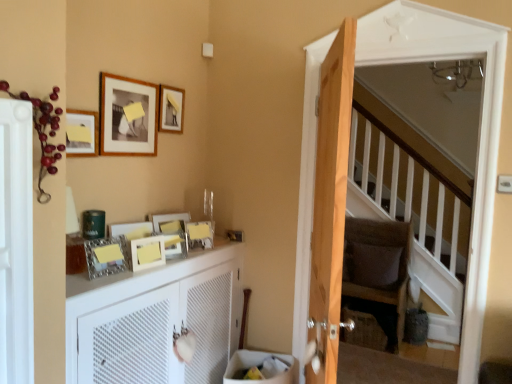
Question: Is matte wooden picture frame at upper left, the second picture frame from the top, wider or thinner than matte wooden picture frame at upper left, which is the third picture frame in top-to-bottom order?

Choices:
 (A) wide
 (B) thin

Answer: (B)

Question: In the image, is matte wooden picture frame at upper left, which appears as the 7th picture frame when ordered from the bottom, positioned in front of or behind matte wooden picture frame at upper left, which is the third picture frame in top-to-bottom order?

Choices:
 (A) front
 (B) behind

Answer: (B)

Question: Which object is the closest to the matte wooden picture frame at upper center, acting as the fifth picture frame starting from the bottom?

Choices:
 (A) matte silver picture frame at center, which ranks as the seventh picture frame in top-to-bottom order
 (B) light brown wooden door at center
 (C) brown fabric pillow at center
 (D) white matte radiator at left, which is the 1th screen door in front-to-back order
 (E) matte wooden picture frame at upper left, which appears as the 7th picture frame when ordered from the bottom

Answer: (A)

Question: Which of these objects is positioned closest to the metallic silver picture frame at upper center, which is the fifth picture frame from top to bottom?

Choices:
 (A) matte plastic picture frame at upper center, the 3th picture frame from the bottom
 (B) matte wooden picture frame at upper left, positioned as the 6th picture frame in bottom-to-top order
 (C) light brown wooden door at center
 (D) brown woven basket at lower right
 (E) dark brown fabric armchair at center

Answer: (A)